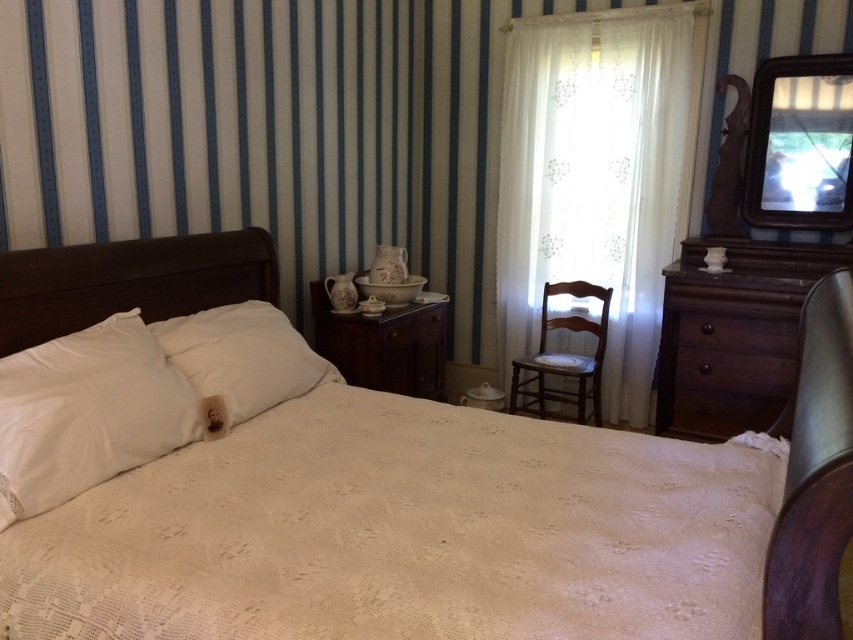
Question: Is white lace curtain at center positioned in front of wooden dresser at center?

Choices:
 (A) yes
 (B) no

Answer: (B)

Question: Which object is farther from the camera taking this photo?

Choices:
 (A) white lace curtain at center
 (B) dark wood dresser at right
 (C) wooden chair at center
 (D) brown wood drawer at right

Answer: (C)

Question: Which point is closer to the camera?

Choices:
 (A) (210, 337)
 (B) (151, 433)
 (C) (440, 324)
 (D) (277, 285)

Answer: (B)

Question: Does white lace curtain at center appear on the left side of wooden chair at center?

Choices:
 (A) yes
 (B) no

Answer: (B)

Question: Considering the real-world distances, which object is closest to the white lace bedspread at center?

Choices:
 (A) wooden chair at center
 (B) white soft pillow at center
 (C) matte brown headboard at left
 (D) brown wood drawer at right

Answer: (C)

Question: Considering the relative positions of white lace curtain at center and dark wood dresser at right in the image provided, where is white lace curtain at center located with respect to dark wood dresser at right?

Choices:
 (A) below
 (B) above

Answer: (B)